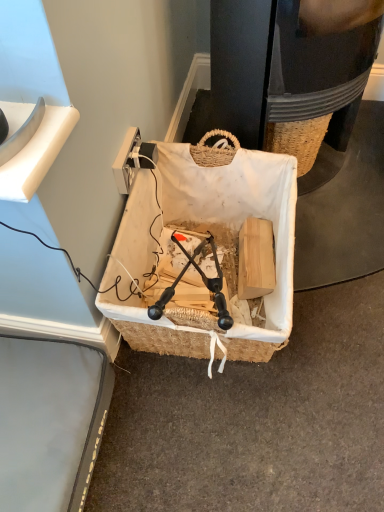
Where is `free point in front of woven straw picnic basket at center`? Image resolution: width=384 pixels, height=512 pixels. free point in front of woven straw picnic basket at center is located at coordinates (235, 435).